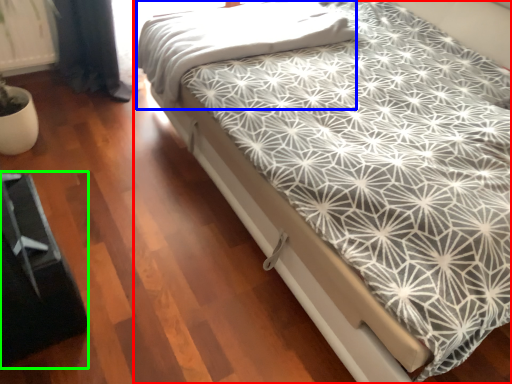
Question: Considering the real-world distances, which object is farthest from bed (highlighted by a red box)? blanket (highlighted by a blue box) or bed frame (highlighted by a green box)?

Choices:
 (A) blanket
 (B) bed frame

Answer: (B)